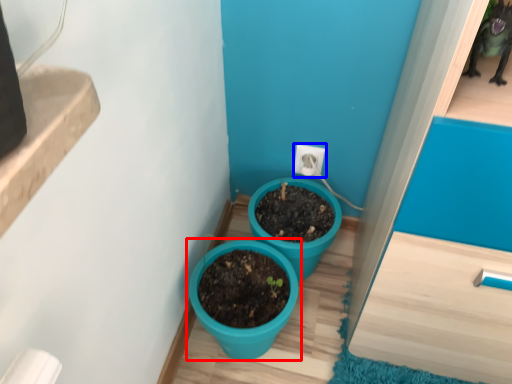
Question: Which object is closer to the camera taking this photo, flowerpot (highlighted by a red box) or electric outlet (highlighted by a blue box)?

Choices:
 (A) flowerpot
 (B) electric outlet

Answer: (A)